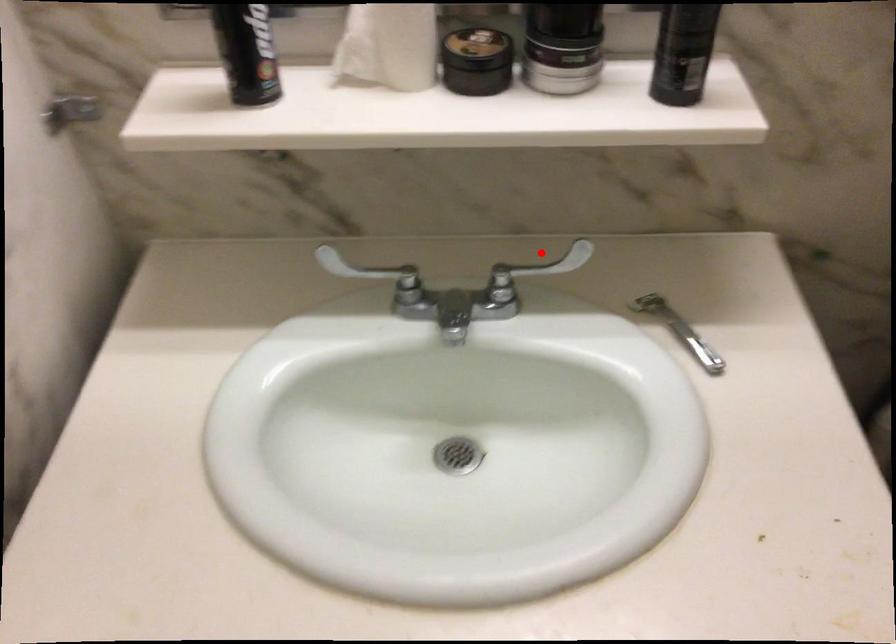
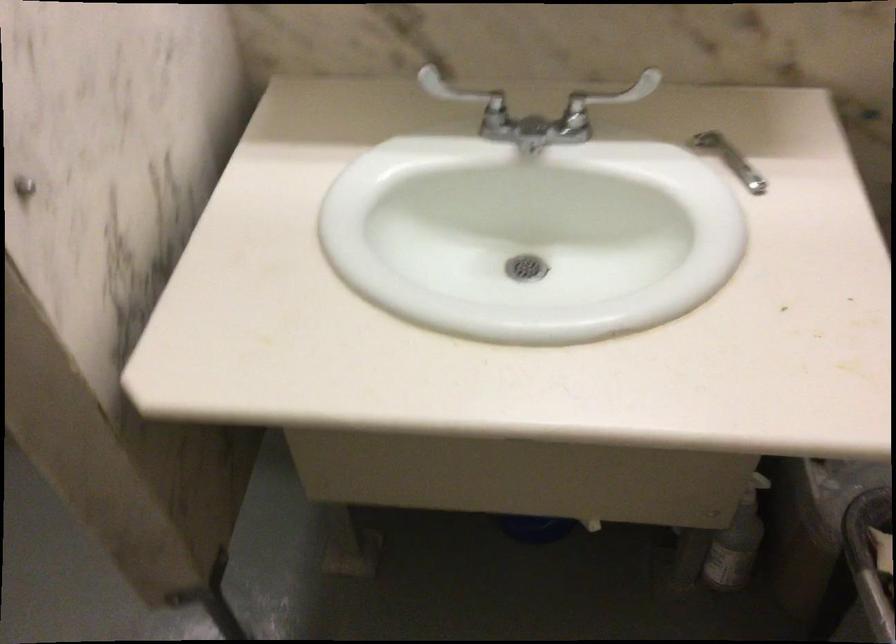
Question: I am providing you with two images of the same scene from different viewpoints. Given a red point in image1, look at the same physical point in image2. Is it:

Choices:
 (A) Closer to the viewpoint
 (B) Farther from the viewpoint

Answer: (B)